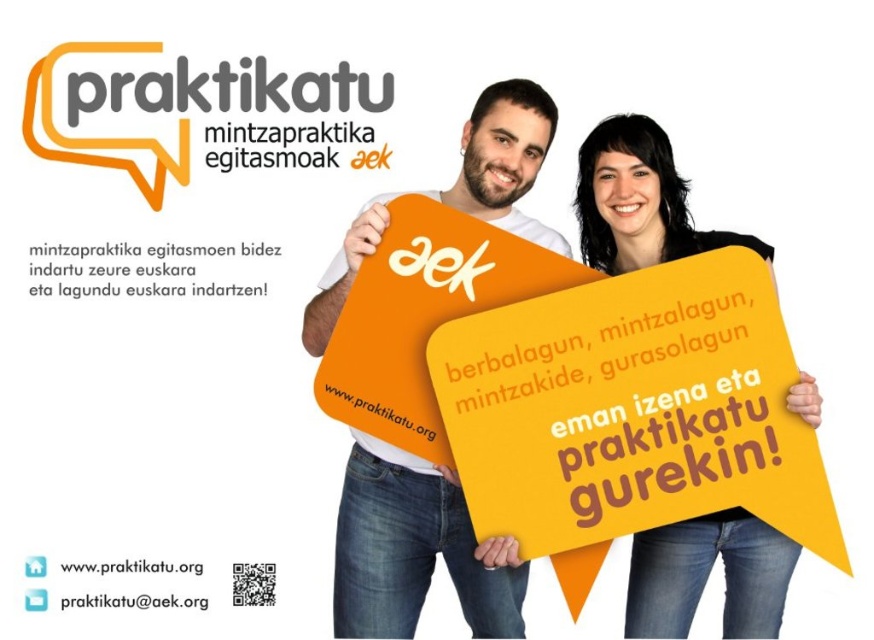
Question: Which object is positioned farthest from the white paper at center?

Choices:
 (A) matte orange speech bubble at upper center
 (B) orange paper sign at center

Answer: (B)

Question: Is orange matte sign at center closer to camera compared to yellow matte sign at center?

Choices:
 (A) no
 (B) yes

Answer: (B)

Question: Does matte orange speech bubble at upper center have a larger size compared to white paper at lower left?

Choices:
 (A) yes
 (B) no

Answer: (A)

Question: Can you confirm if orange matte sign at center is positioned to the left of orange paper sign at center?

Choices:
 (A) yes
 (B) no

Answer: (B)

Question: Which point is closer to the camera?

Choices:
 (A) (344, 625)
 (B) (144, 253)
 (C) (651, 577)
 (D) (70, 568)

Answer: (A)

Question: Which object appears farthest from the camera in this image?

Choices:
 (A) white paper at center
 (B) matte orange speech bubble at upper center
 (C) yellow matte sign at center

Answer: (B)